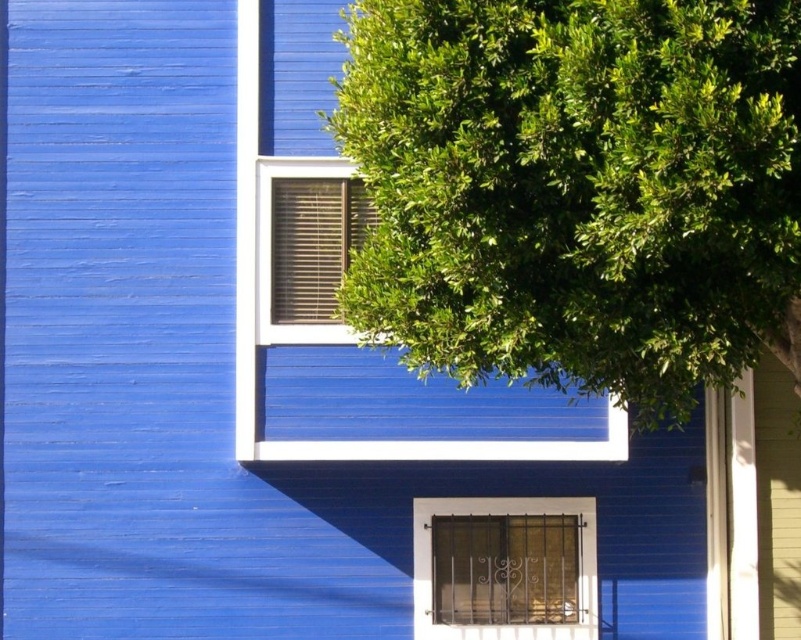
Question: Considering the real-world distances, which object is closest to the metallic gold window at lower center?

Choices:
 (A) green leafy tree at upper right
 (B) matte brown blinds at upper center

Answer: (B)

Question: Does green leafy tree at upper right have a larger size compared to matte brown blinds at upper center?

Choices:
 (A) yes
 (B) no

Answer: (A)

Question: Which of these objects is positioned closest to the matte brown blinds at upper center?

Choices:
 (A) metallic gold window at lower center
 (B) green leafy tree at upper right

Answer: (A)

Question: Can you confirm if metallic gold window at lower center is thinner than matte brown blinds at upper center?

Choices:
 (A) yes
 (B) no

Answer: (B)

Question: Which object appears closest to the camera in this image?

Choices:
 (A) matte brown blinds at upper center
 (B) metallic gold window at lower center
 (C) green leafy tree at upper right

Answer: (C)

Question: Considering the relative positions of green leafy tree at upper right and metallic gold window at lower center in the image provided, where is green leafy tree at upper right located with respect to metallic gold window at lower center?

Choices:
 (A) below
 (B) above

Answer: (B)